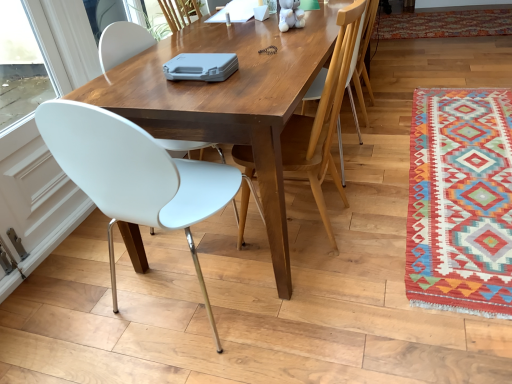
At what (x,y) coordinates should I click in order to perform the action: click on free region under white plastic chair at left, which is the 3th chair in right-to-left order (from a real-world perspective). Please return your answer as a coordinate pair (x, y). The width and height of the screenshot is (512, 384). Looking at the image, I should click on (179, 306).